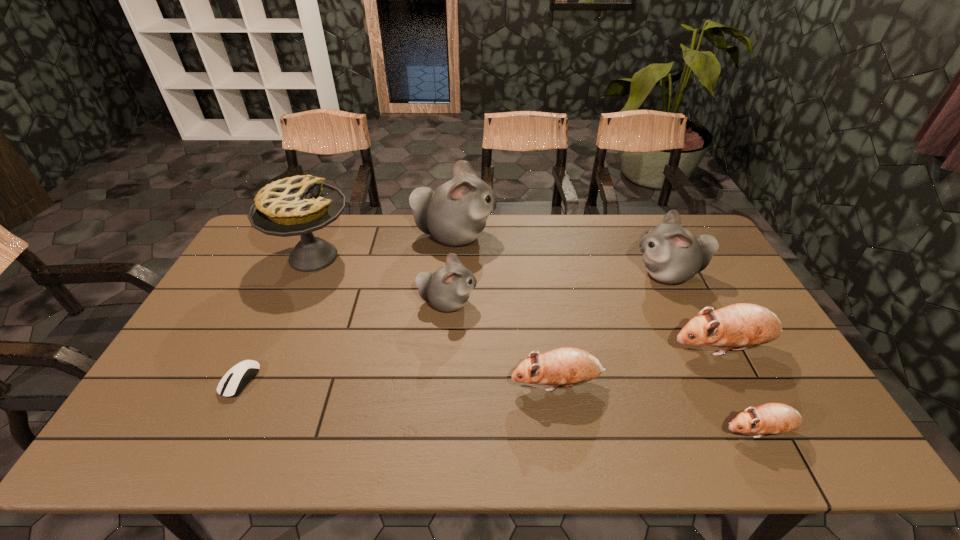
Where is `vacant area that lies between the smallest white hamster and the pie`? The height and width of the screenshot is (540, 960). vacant area that lies between the smallest white hamster and the pie is located at coordinates (380, 280).

The height and width of the screenshot is (540, 960). I want to click on free spot between the second shortest hamster and the farthest brown hamster, so click(639, 366).

Find the location of `free area in between the white mouse and the pie`. free area in between the white mouse and the pie is located at coordinates (276, 319).

Locate an element on the screen. This screenshot has height=540, width=960. blank region between the shortest object and the pie is located at coordinates [276, 319].

This screenshot has width=960, height=540. In order to click on vacant point located between the fourth object from right to left and the shortest hamster in this screenshot , I will do `click(659, 407)`.

Where is `free space between the mouse and the smallest white hamster`? Image resolution: width=960 pixels, height=540 pixels. free space between the mouse and the smallest white hamster is located at coordinates (344, 342).

The height and width of the screenshot is (540, 960). I want to click on vacant area that lies between the farthest brown hamster and the mouse, so click(x=481, y=364).

The height and width of the screenshot is (540, 960). In order to click on vacant point located between the smallest white hamster and the farthest brown hamster in this screenshot , I will do `click(585, 325)`.

The width and height of the screenshot is (960, 540). I want to click on empty space that is in between the shortest object and the smallest brown hamster, so click(500, 406).

I want to click on the sixth closest object relative to the pie, so click(740, 326).